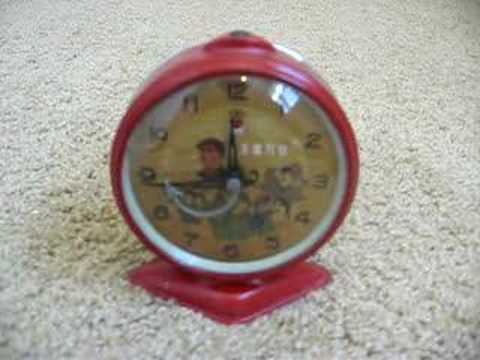
What are the coordinates of `carpet` in the screenshot? It's located at (408, 179).